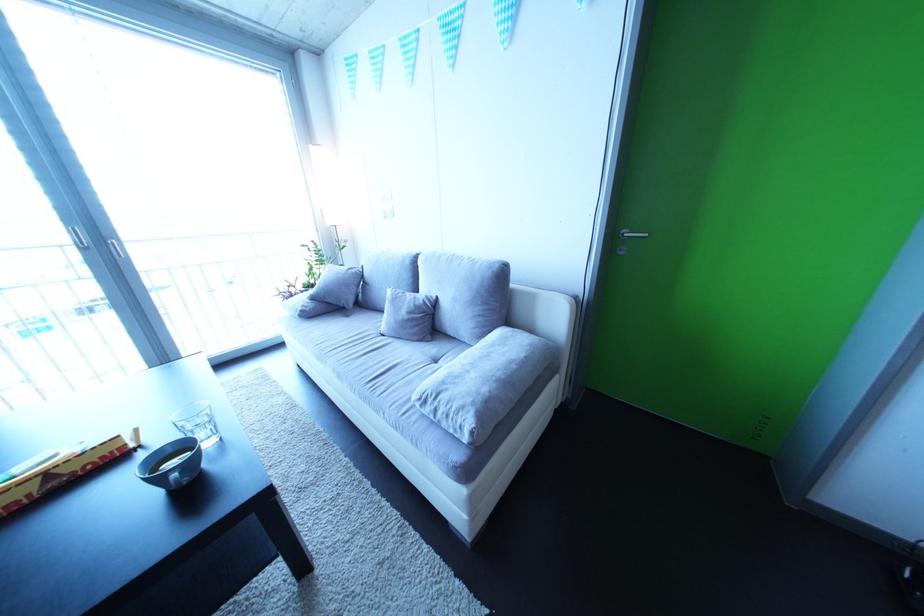
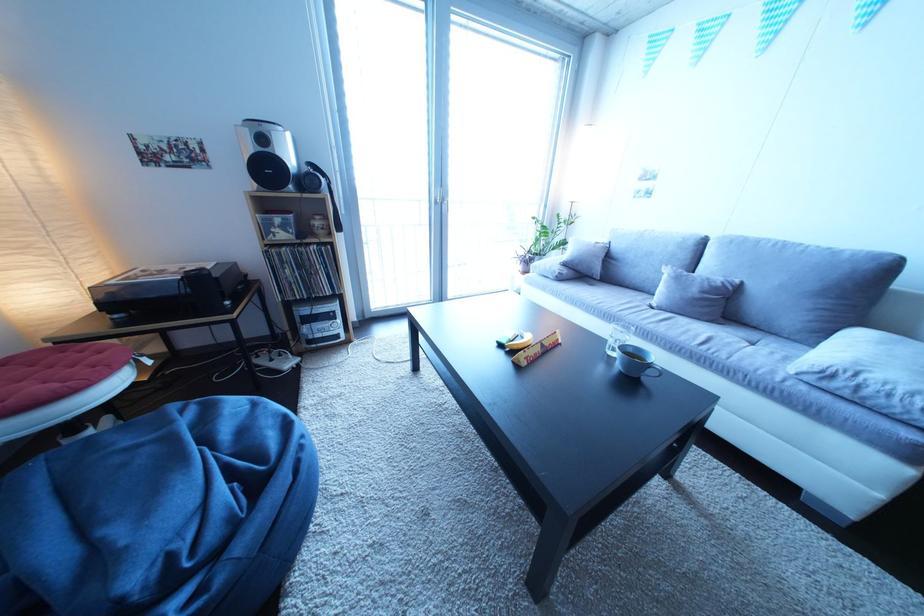
In the second image, find the point that corresponds to the point at 447,302 in the first image.

(750, 286)